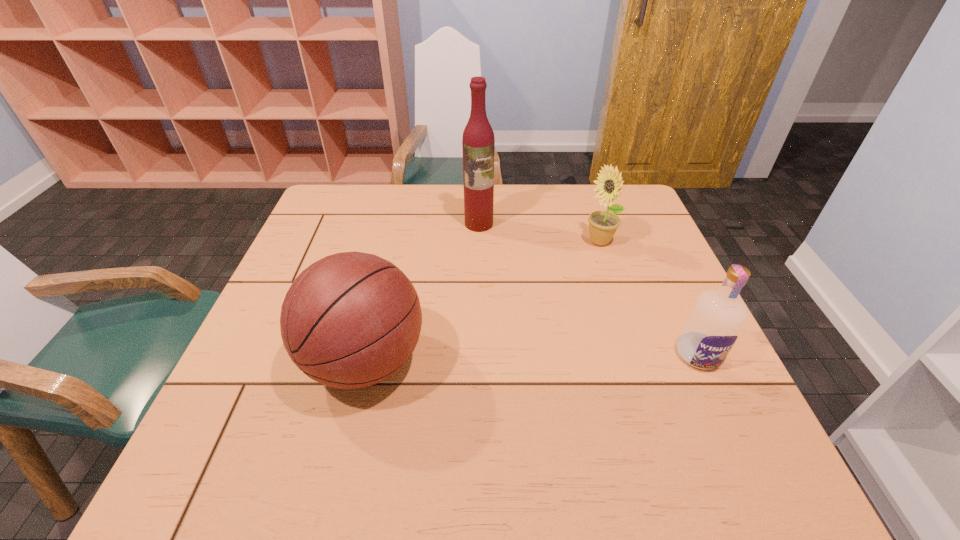
Where is `vacant space located 0.320m on the face of the sunflower`? The width and height of the screenshot is (960, 540). vacant space located 0.320m on the face of the sunflower is located at coordinates (548, 327).

In order to click on free point located on the label of the farthest object in this screenshot , I will do 493,314.

Identify the location of vacant position located on the label of the farthest object. The width and height of the screenshot is (960, 540). (492, 308).

This screenshot has width=960, height=540. In order to click on vacant space positioned on the label of the farthest object in this screenshot , I will do `click(491, 296)`.

This screenshot has height=540, width=960. I want to click on object that is positioned at the far edge, so click(478, 143).

At what (x,y) coordinates should I click in order to perform the action: click on object that is at the near edge. Please return your answer as a coordinate pair (x, y). Looking at the image, I should click on (350, 320).

This screenshot has width=960, height=540. In order to click on object present at the left edge in this screenshot , I will do `click(350, 320)`.

Find the location of `vodka located at the right edge`. vodka located at the right edge is located at coordinates (713, 325).

The width and height of the screenshot is (960, 540). What are the coordinates of `sunflower present at the right edge` in the screenshot? It's located at (602, 224).

Where is `object positioned at the near left corner`? The image size is (960, 540). object positioned at the near left corner is located at coordinates (350, 320).